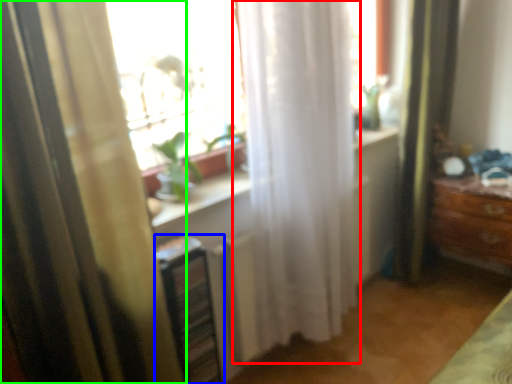
Question: Which object is positioned farthest from curtain (highlighted by a red box)? Select from shelf (highlighted by a blue box) and curtain (highlighted by a green box).

Choices:
 (A) shelf
 (B) curtain

Answer: (B)